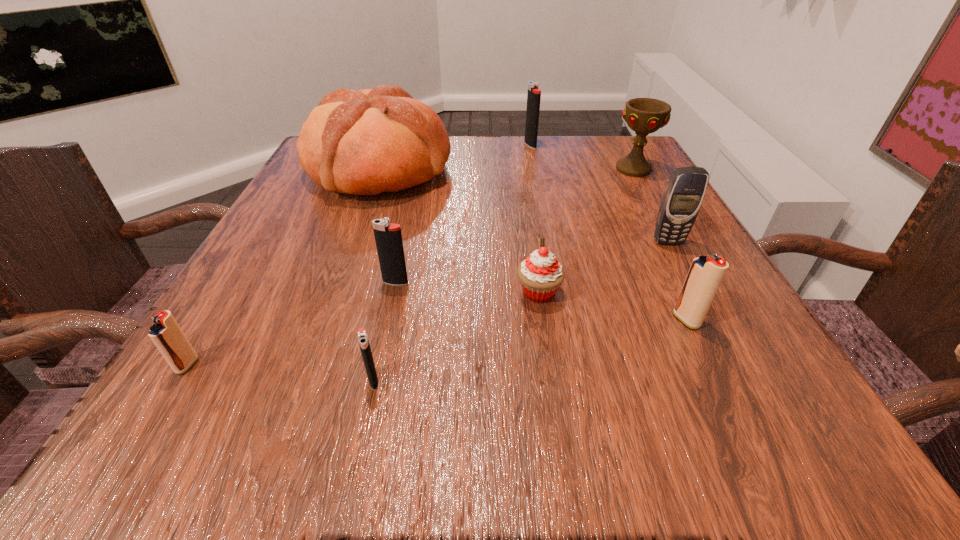
Identify the location of free space between the fourth nearest igniter and the nearest black igniter. The width and height of the screenshot is (960, 540). (384, 331).

Locate an element on the screen. free space between the biggest black igniter and the smallest black igniter is located at coordinates (452, 262).

Where is `free space between the third nearest igniter and the farthest igniter`? The height and width of the screenshot is (540, 960). free space between the third nearest igniter and the farthest igniter is located at coordinates (609, 232).

In order to click on free space between the seventh farthest object and the red chalice in this screenshot , I will do `click(660, 245)`.

In order to click on unoccupied area between the second nearest black igniter and the red chalice in this screenshot , I will do `click(515, 226)`.

Locate an element on the screen. This screenshot has height=540, width=960. empty space between the nearer red igniter and the cellular telephone is located at coordinates [427, 303].

This screenshot has width=960, height=540. I want to click on vacant area that lies between the smallest black igniter and the second farthest igniter, so click(384, 331).

Where is `object that is the fourth nearest to the chalice`? object that is the fourth nearest to the chalice is located at coordinates (540, 274).

Identify which object is located as the eighth nearest to the third nearest igniter. Please provide its 2D coordinates. Your answer should be formatted as a tuple, i.e. [(x, y)], where the tuple contains the x and y coordinates of a point satisfying the conditions above.

[(166, 334)]

The width and height of the screenshot is (960, 540). What are the coordinates of `igniter object that ranks as the third closest to the smallest black igniter` in the screenshot? It's located at (706, 273).